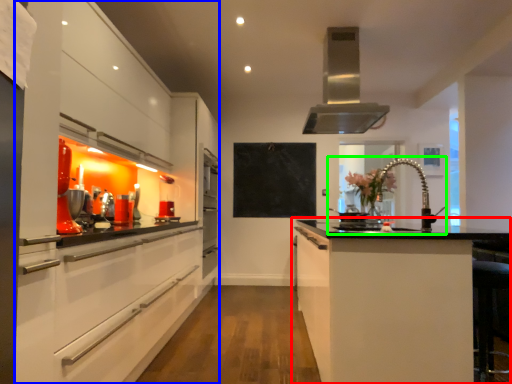
Question: Which object is the closest to the cabinetry (highlighted by a red box)? Choose among these: cabinetry (highlighted by a blue box) or sink (highlighted by a green box).

Choices:
 (A) cabinetry
 (B) sink

Answer: (B)